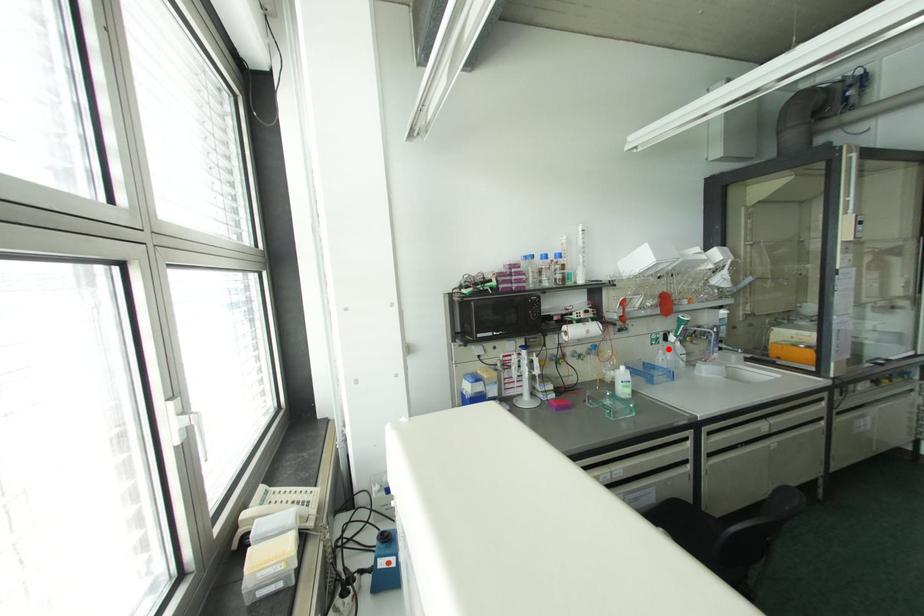
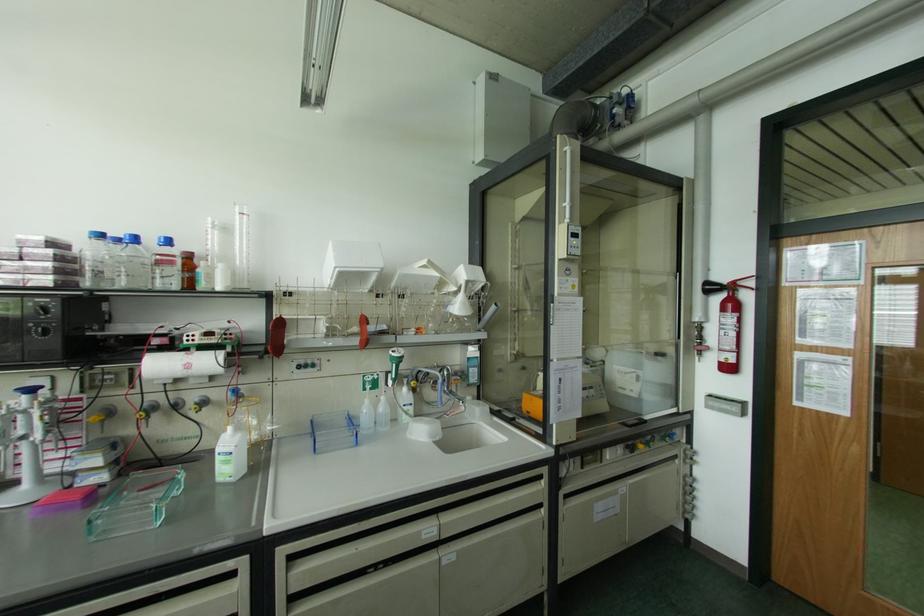
Where in the second image is the point corresponding to the highlighted location from the first image?

(382, 398)